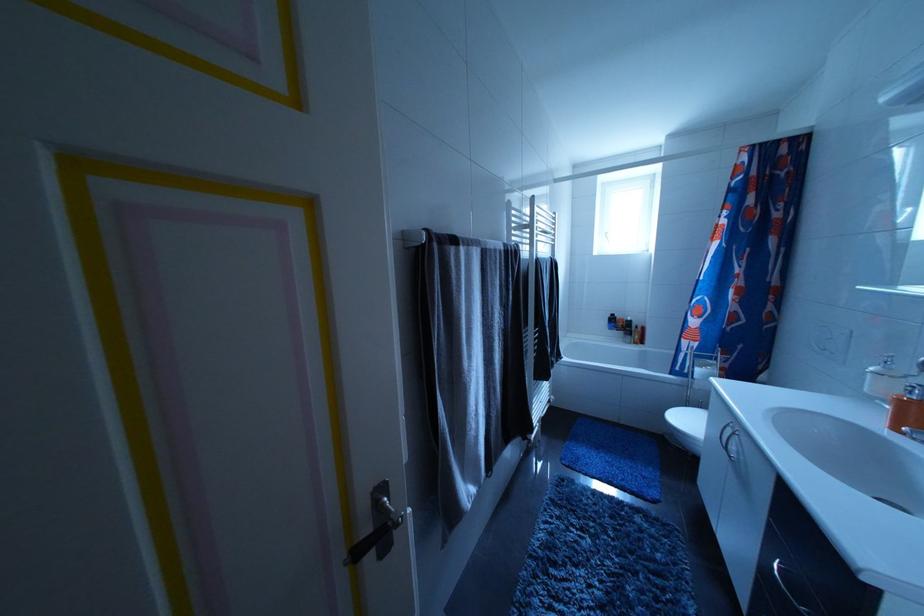
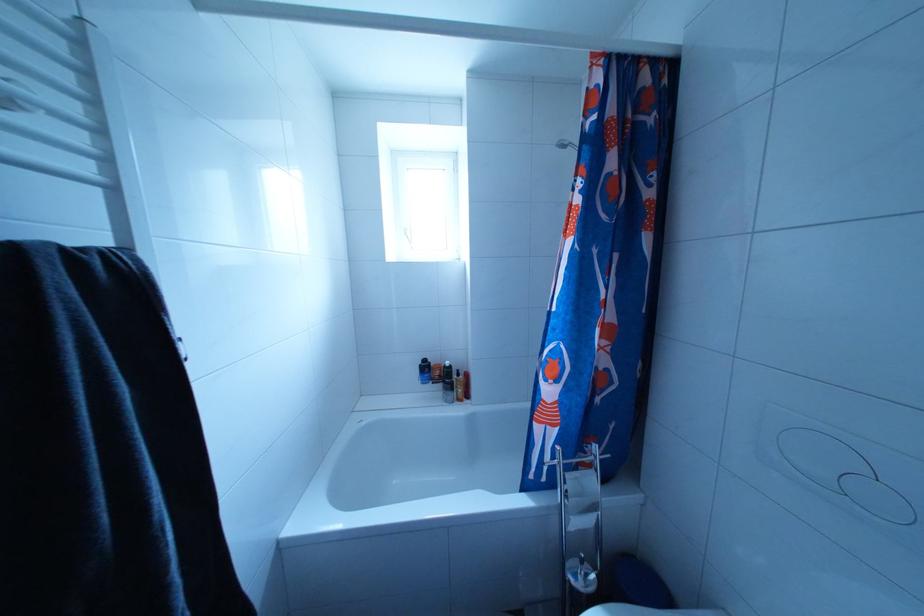
The point at (708, 376) is marked in the first image. Where is the corresponding point in the second image?

(578, 493)